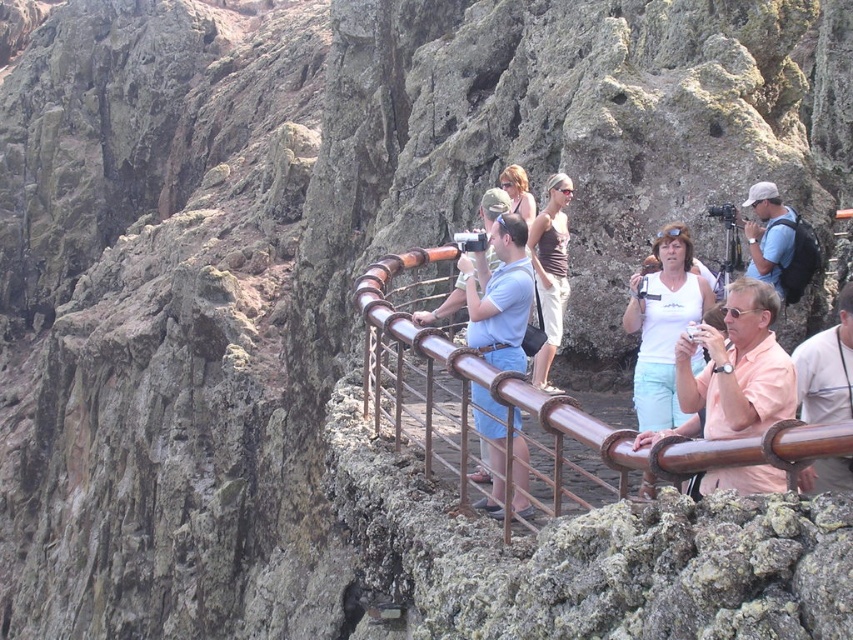
Is matte blue shirt at center further to the viewer compared to blonde hair at center?

That is False.

Who is more distant from viewer, [519,288] or [505,179]?

The point [505,179] is behind.

The height and width of the screenshot is (640, 853). Identify the location of matte blue shirt at center. (500, 296).

Does brown metal railing at center appear on the right side of matte brown tank top at center?

In fact, brown metal railing at center is to the left of matte brown tank top at center.

Is point (454, 420) positioned before point (553, 300)?

Yes, point (454, 420) is in front of point (553, 300).

The image size is (853, 640). In order to click on brown metal railing at center in this screenshot , I will do `click(526, 410)`.

Consider the image. Can you confirm if matte blue shirt at center is positioned to the left of white matte tank top at center?

Yes, matte blue shirt at center is to the left of white matte tank top at center.

From the picture: Does matte blue shirt at center have a lesser height compared to white matte tank top at center?

No, matte blue shirt at center is not shorter than white matte tank top at center.

Which is behind, point (526, 234) or point (639, 323)?

Positioned behind is point (639, 323).

This screenshot has height=640, width=853. I want to click on matte blue shirt at center, so click(x=500, y=296).